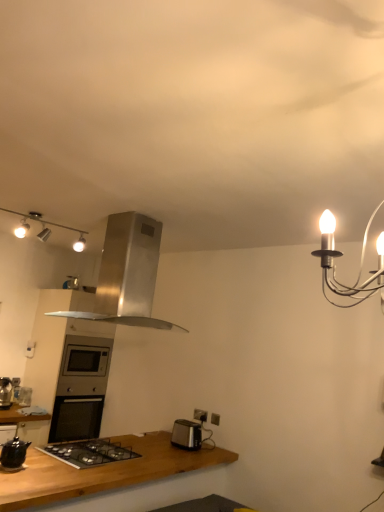
Where is `blank space above matte silver track lights at upper left (from a real-world perspective)`? This screenshot has width=384, height=512. blank space above matte silver track lights at upper left (from a real-world perspective) is located at coordinates (35, 207).